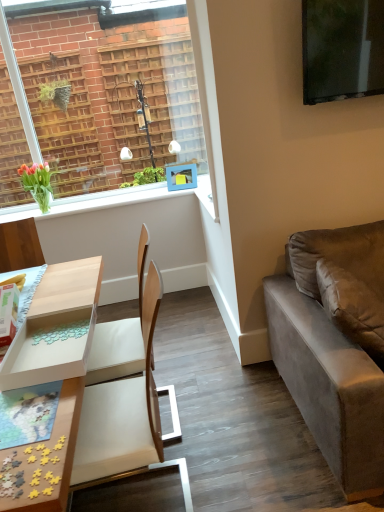
The image size is (384, 512). In order to click on vacant space situated above green glass vase at upper left (from a real-world perspective) in this screenshot , I will do `click(107, 195)`.